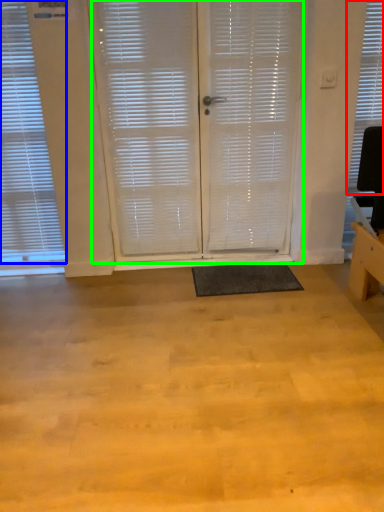
Question: Considering the real-world distances, which object is closest to window blind (highlighted by a red box)? window blind (highlighted by a blue box) or screen door (highlighted by a green box).

Choices:
 (A) window blind
 (B) screen door

Answer: (B)